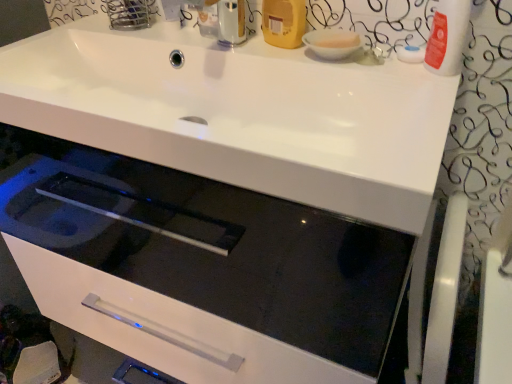
Locate an element on the screen. The image size is (512, 384). free point to the left of yellow matte plastic bottle at upper right is located at coordinates (210, 41).